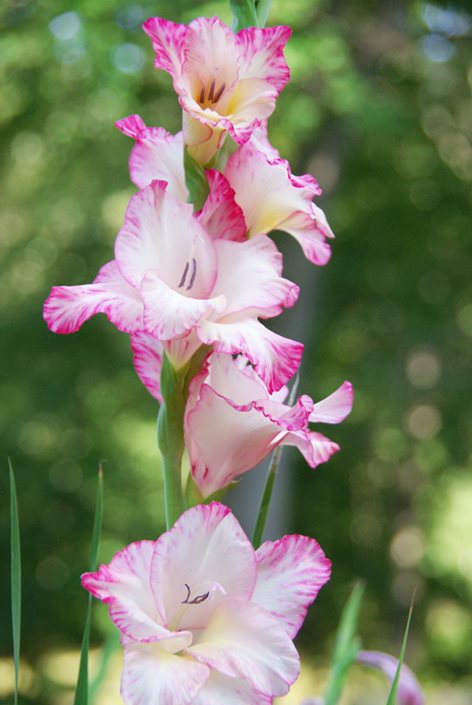
This screenshot has height=705, width=472. In order to click on canopy in this screenshot , I will do 414,317, 22,154.